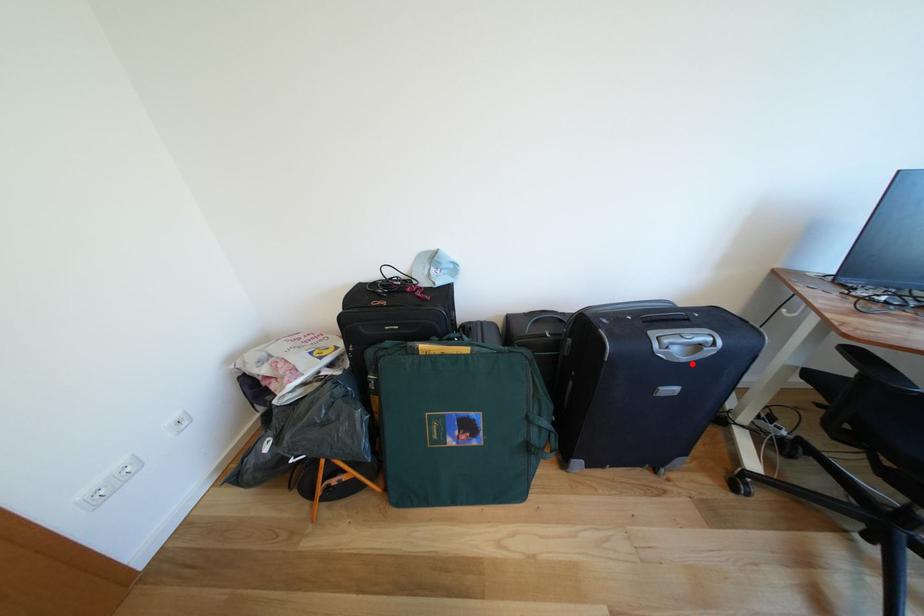
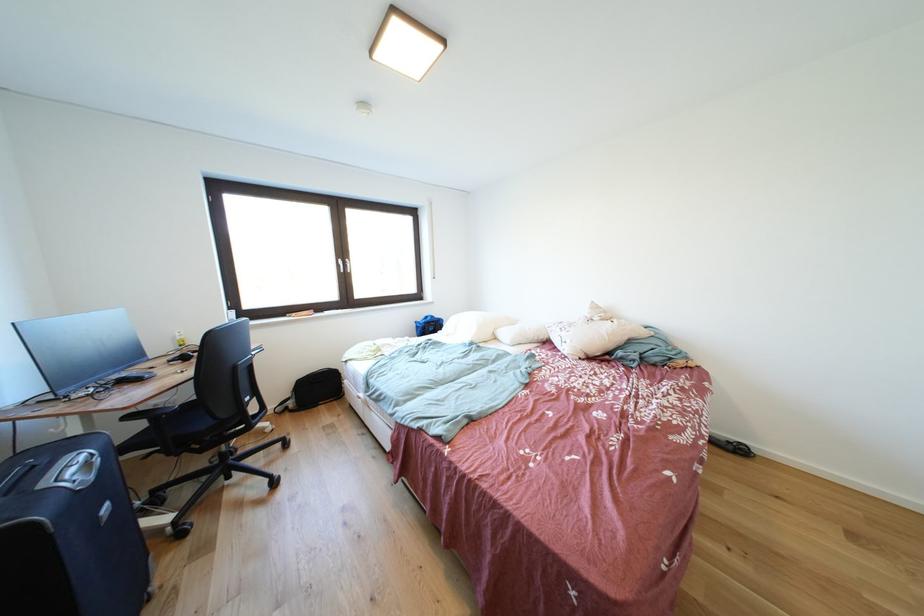
Locate, in the second image, the point that corresponds to the highlighted location in the first image.

(101, 483)